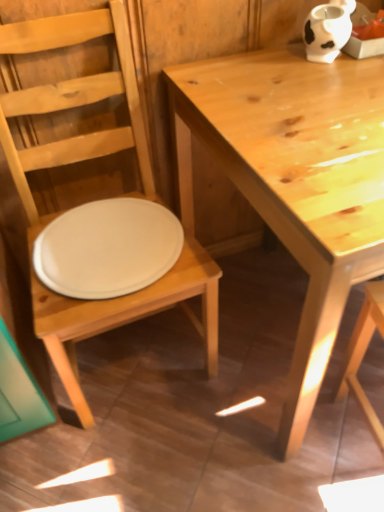
Question: Could you tell me if white matte plate at center is facing matte white plate at left?

Choices:
 (A) no
 (B) yes

Answer: (B)

Question: Is white matte plate at center positioned far away from matte white plate at left?

Choices:
 (A) no
 (B) yes

Answer: (A)

Question: From a real-world perspective, is white matte plate at center under matte white plate at left?

Choices:
 (A) no
 (B) yes

Answer: (A)

Question: Is white matte plate at center oriented away from matte white plate at left?

Choices:
 (A) yes
 (B) no

Answer: (A)

Question: Can you see white matte plate at center touching matte white plate at left?

Choices:
 (A) no
 (B) yes

Answer: (A)

Question: Does white matte plate at center have a lesser height compared to matte white plate at left?

Choices:
 (A) no
 (B) yes

Answer: (B)

Question: Does light brown wooden table at center have a smaller size compared to matte white plate at left?

Choices:
 (A) no
 (B) yes

Answer: (A)

Question: Considering the relative sizes of light brown wooden table at center and matte white plate at left in the image provided, is light brown wooden table at center wider than matte white plate at left?

Choices:
 (A) no
 (B) yes

Answer: (B)

Question: Can you confirm if light brown wooden table at center is shorter than matte white plate at left?

Choices:
 (A) no
 (B) yes

Answer: (B)

Question: Is light brown wooden table at center surrounding matte white plate at left?

Choices:
 (A) no
 (B) yes

Answer: (A)

Question: From the image's perspective, is light brown wooden table at center over matte white plate at left?

Choices:
 (A) no
 (B) yes

Answer: (B)

Question: Is light brown wooden table at center outside of matte white plate at left?

Choices:
 (A) no
 (B) yes

Answer: (B)

Question: Could you tell me if white matte plate at center is facing white matte cow-shaped vase at upper right?

Choices:
 (A) yes
 (B) no

Answer: (B)